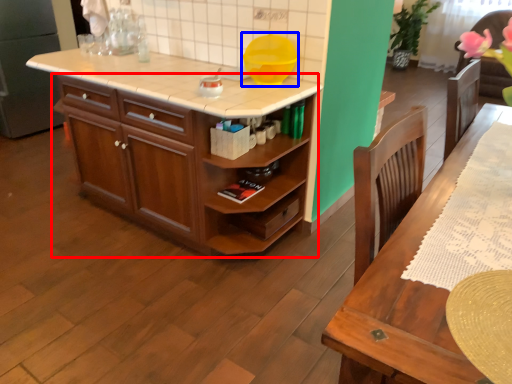
Question: Which of the following is the closest to the observer, cabinetry (highlighted by a red box) or appliance (highlighted by a blue box)?

Choices:
 (A) cabinetry
 (B) appliance

Answer: (A)